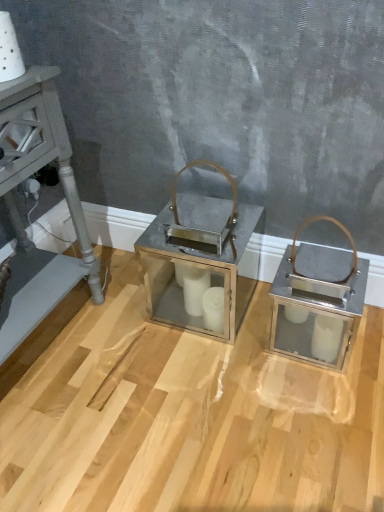
Where is `free area below metallic silver lantern at center (from a real-world perspective)`? free area below metallic silver lantern at center (from a real-world perspective) is located at coordinates (179, 307).